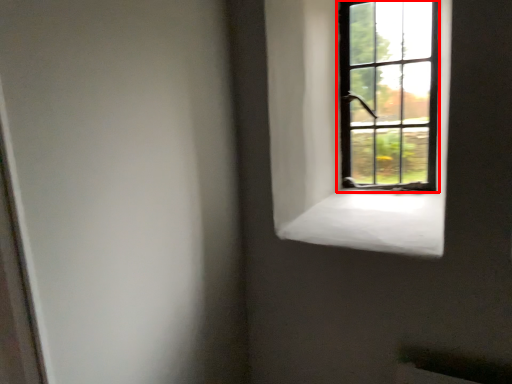
Question: Where is window (annotated by the red box) located in relation to window sill in the image?

Choices:
 (A) left
 (B) right

Answer: (B)